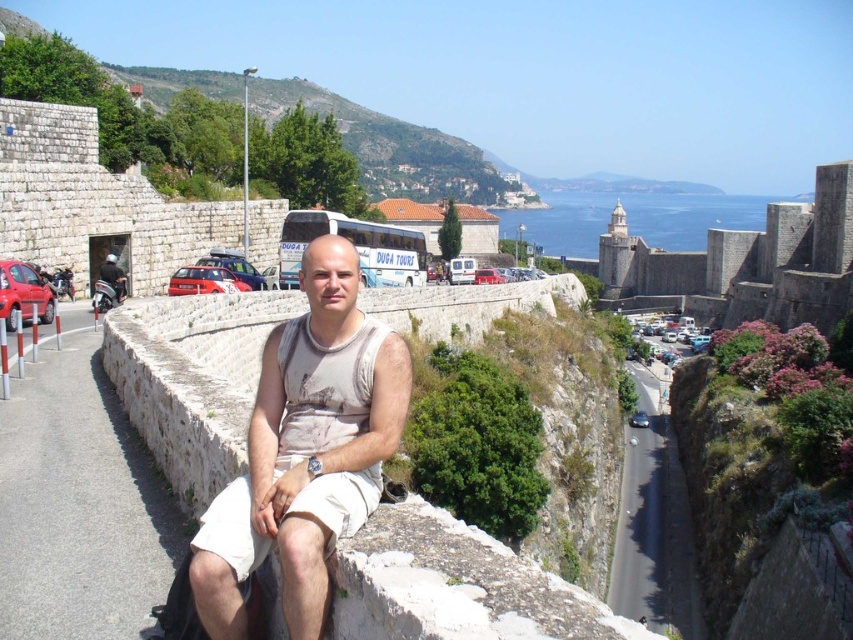
Can you confirm if white stone ledge at center is positioned to the left of white cotton tank top at center?

Incorrect, white stone ledge at center is not on the left side of white cotton tank top at center.

Find the location of a particular element. white stone ledge at center is located at coordinates (456, 586).

Find the location of `white stone ledge at center`. white stone ledge at center is located at coordinates (456, 586).

Between white cotton tank top at center and stone wall at upper right, which one has less height?

white cotton tank top at center is shorter.

Does point (355, 289) come in front of point (836, 192)?

Yes, it is.

The width and height of the screenshot is (853, 640). What do you see at coordinates (305, 451) in the screenshot?
I see `white cotton tank top at center` at bounding box center [305, 451].

What are the coordinates of `white cotton tank top at center` in the screenshot? It's located at (305, 451).

Between white stone ledge at center and stone wall at upper right, which one has more height?

stone wall at upper right

Is point (439, 564) closer to camera compared to point (637, 252)?

Yes, it is.

I want to click on white stone ledge at center, so click(456, 586).

The height and width of the screenshot is (640, 853). In order to click on white stone ledge at center in this screenshot , I will do `click(456, 586)`.